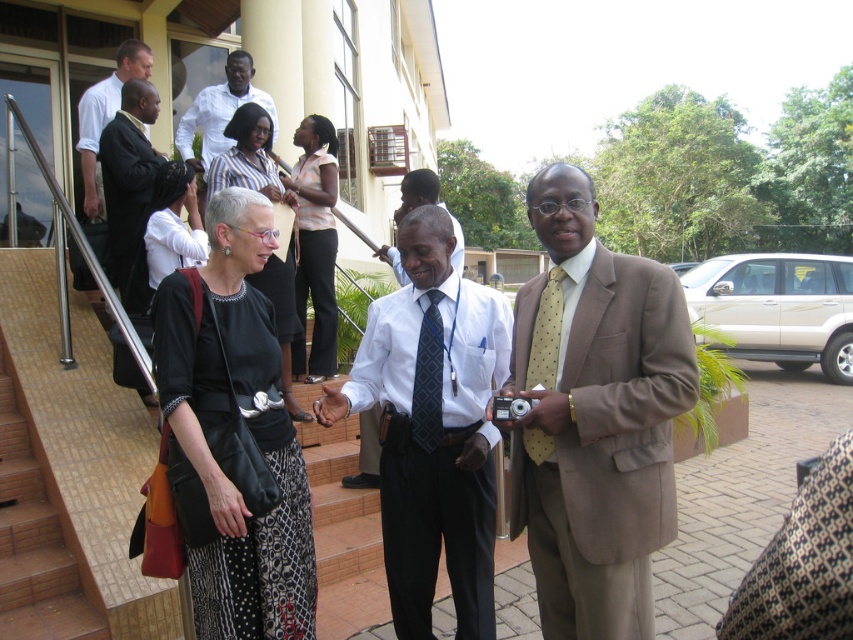
Who is positioned more to the right, white shirt at center or brown tile stairs at lower left?

Positioned to the right is white shirt at center.

Consider the image. Can you confirm if white shirt at center is shorter than brown tile stairs at lower left?

No, white shirt at center is not shorter than brown tile stairs at lower left.

Who is more forward, (398, 339) or (35, 545)?

Point (398, 339) is in front.

This screenshot has height=640, width=853. What are the coordinates of `white shirt at center` in the screenshot? It's located at (432, 428).

Does matte black dress at center have a greater height compared to white shirt with blue tie at center?

Yes.

Does matte black dress at center lie behind white shirt with blue tie at center?

No, it is in front of white shirt with blue tie at center.

Describe the element at coordinates (173, 225) in the screenshot. I see `matte black dress at center` at that location.

Find the location of `matte black dress at center`. matte black dress at center is located at coordinates (173, 225).

Is matte brown suit at center behind dark suit at left?

No, matte brown suit at center is closer to the viewer.

Who is taller, matte brown suit at center or dark suit at left?

matte brown suit at center is taller.

Between point (576, 609) and point (90, 182), which one is positioned behind?

The point (90, 182) is more distant.

I want to click on matte brown suit at center, so click(595, 417).